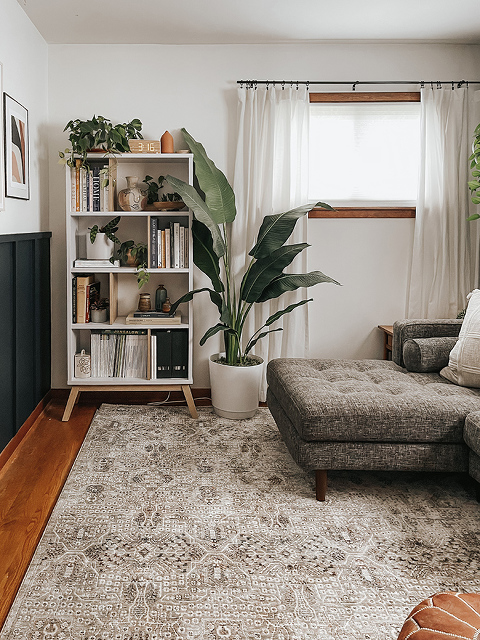
At what (x,y) coordinates should I click in order to perform the action: click on curtains. Please return your answer as a coordinate pair (x, y). This screenshot has width=480, height=640. Looking at the image, I should click on (269, 180), (444, 188).